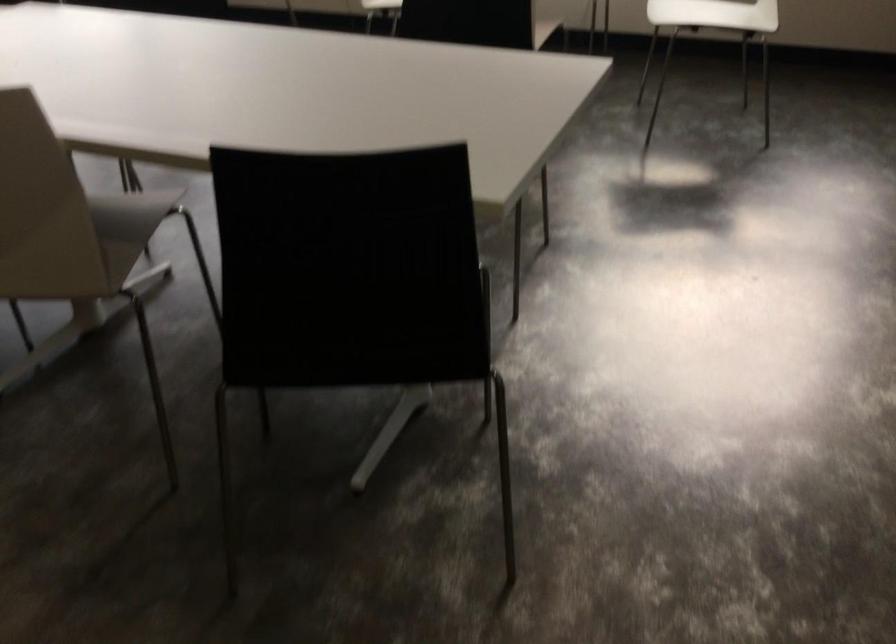
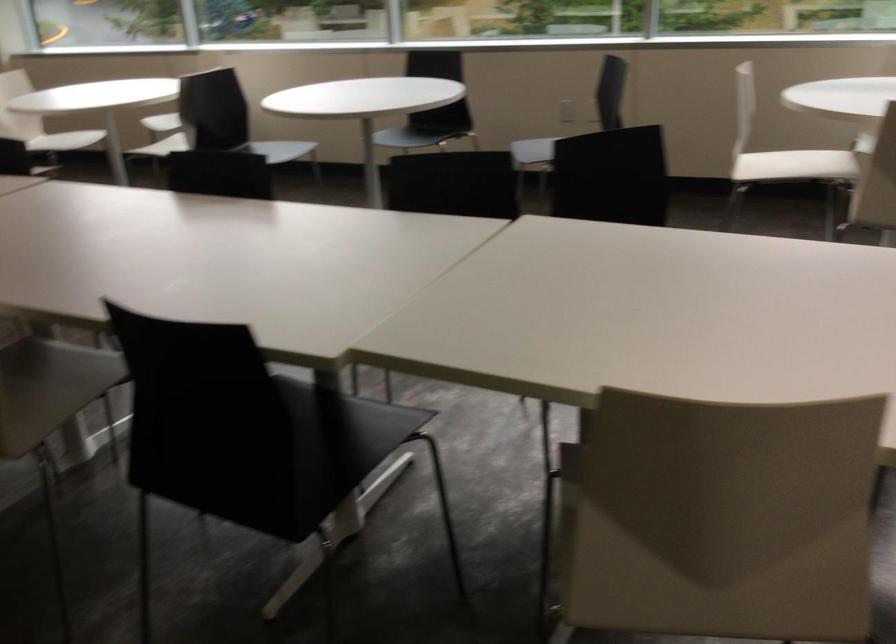
Question: The first image is from the beginning of the video and the second image is from the end. How did the camera likely rotate when shooting the video?

Choices:
 (A) Left
 (B) Right
 (C) Up
 (D) Down

Answer: (A)